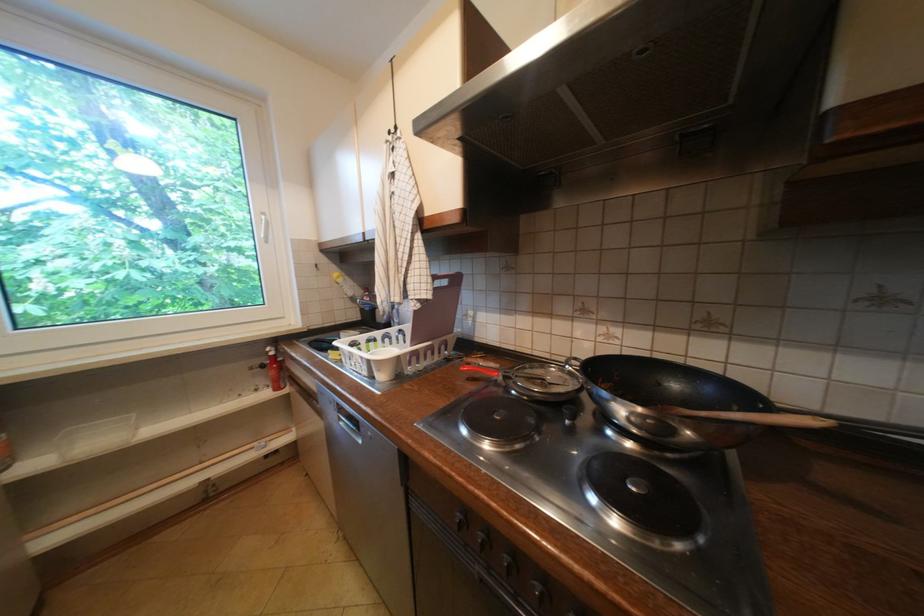
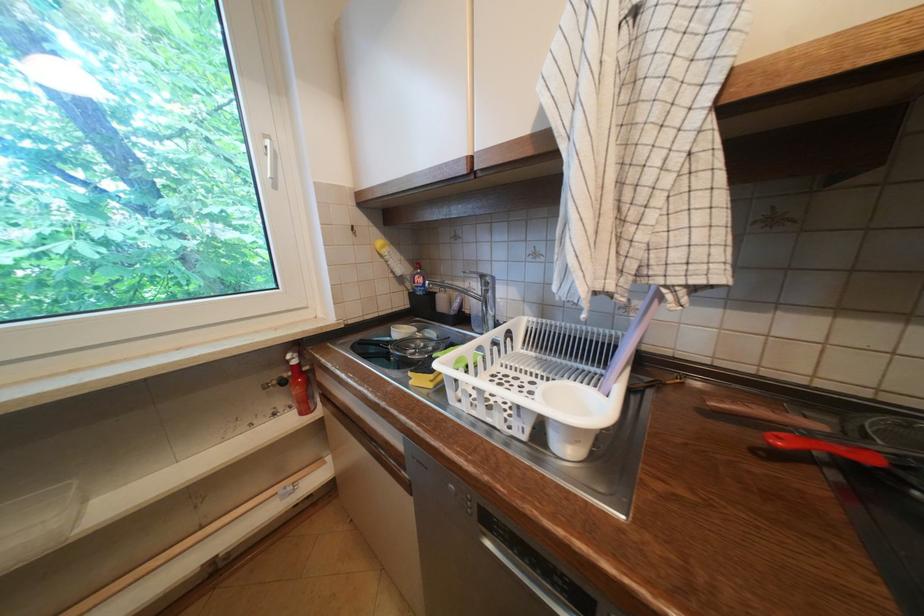
Find the pixel in the second image that matches point (366, 307) in the first image.

(412, 291)